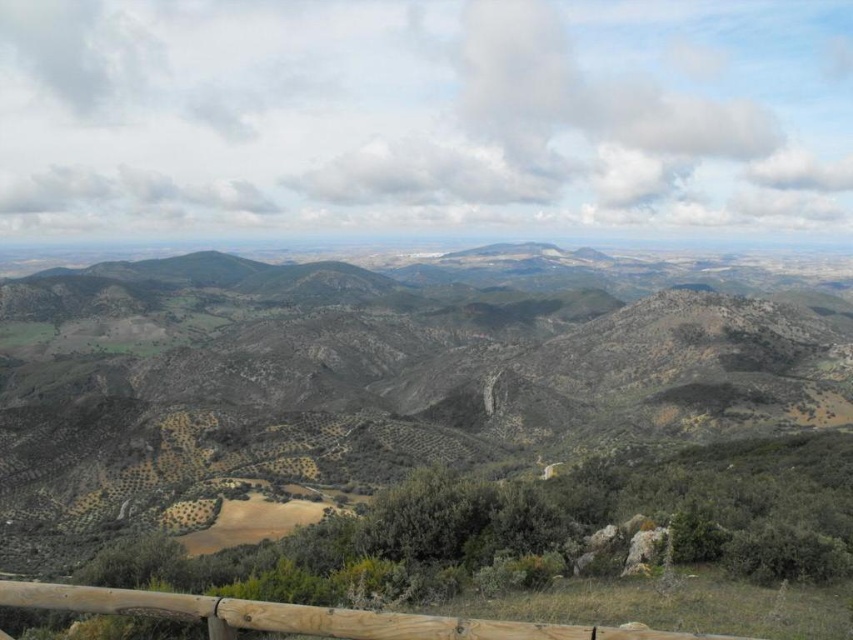
Question: Which point is closer to the camera taking this photo?

Choices:
 (A) (711, 636)
 (B) (200, 454)

Answer: (A)

Question: Considering the relative positions of green grassy hillside at center and brown wooden fence at lower center in the image provided, where is green grassy hillside at center located with respect to brown wooden fence at lower center?

Choices:
 (A) right
 (B) left

Answer: (B)

Question: Is green grassy hillside at center above brown wooden fence at lower center?

Choices:
 (A) yes
 (B) no

Answer: (A)

Question: Which object is farther from the camera taking this photo?

Choices:
 (A) brown wooden fence at lower center
 (B) green grassy hillside at center

Answer: (B)

Question: Which of the following is the closest to the observer?

Choices:
 (A) (62, 593)
 (B) (486, 349)

Answer: (A)

Question: Is green grassy hillside at center positioned before brown wooden fence at lower center?

Choices:
 (A) no
 (B) yes

Answer: (A)